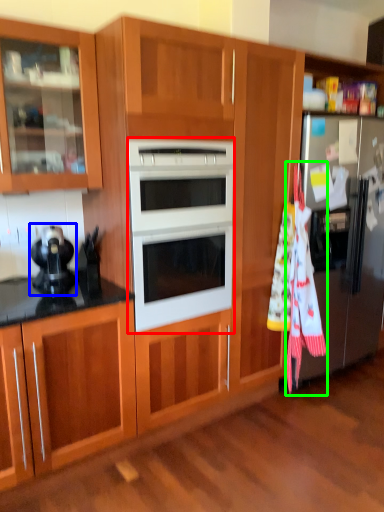
Question: Considering the real-world distances, which object is closest to microwave oven (highlighted by a red box)? appliance (highlighted by a blue box) or beach towel (highlighted by a green box).

Choices:
 (A) appliance
 (B) beach towel

Answer: (A)